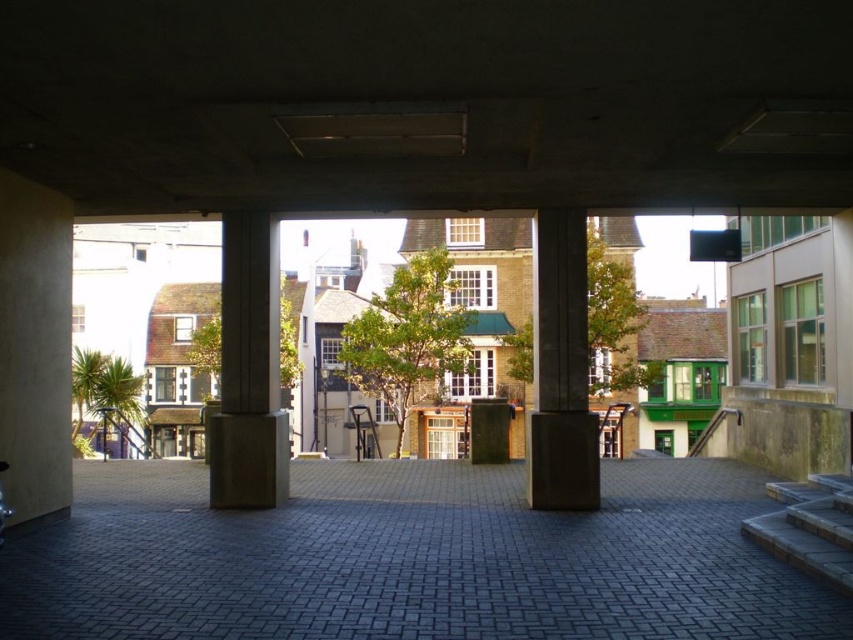
Between gray concrete alley at center and concrete at center, which one appears on the right side from the viewer's perspective?

gray concrete alley at center is more to the right.

Does gray concrete alley at center have a lesser width compared to concrete at center?

No, gray concrete alley at center is not thinner than concrete at center.

Is point (305, 483) farther from camera compared to point (256, 461)?

Yes, it is.

Where is `gray concrete alley at center`? This screenshot has height=640, width=853. gray concrete alley at center is located at coordinates (410, 557).

Between gray concrete alley at center and concrete column at center, which one has less height?

With less height is gray concrete alley at center.

Does gray concrete alley at center have a lesser height compared to concrete column at center?

Indeed, gray concrete alley at center has a lesser height compared to concrete column at center.

Is point (329, 586) positioned behind point (553, 452)?

No, it is not.

You are a GUI agent. You are given a task and a screenshot of the screen. Output one action in this format:
    pyautogui.click(x=<x>, y=<y>)
    Task: Click on the gray concrete alley at center
    This screenshot has width=853, height=640.
    Given the screenshot: What is the action you would take?
    pyautogui.click(x=410, y=557)

Who is taller, concrete at center or concrete column at center?

concrete at center

The width and height of the screenshot is (853, 640). Describe the element at coordinates (248, 371) in the screenshot. I see `concrete at center` at that location.

Which is in front, point (254, 216) or point (548, 451)?

Point (548, 451)

Locate an element on the screen. concrete at center is located at coordinates (248, 371).